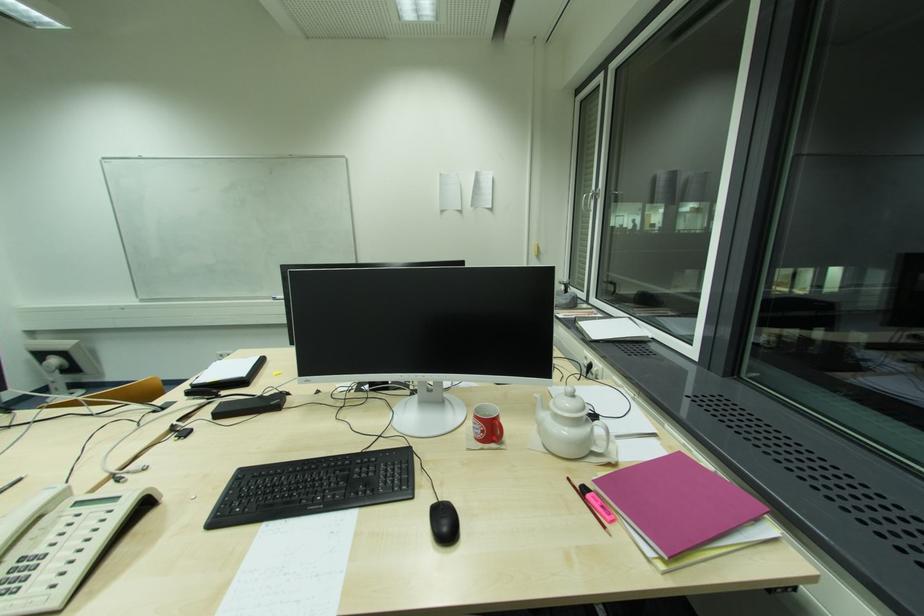
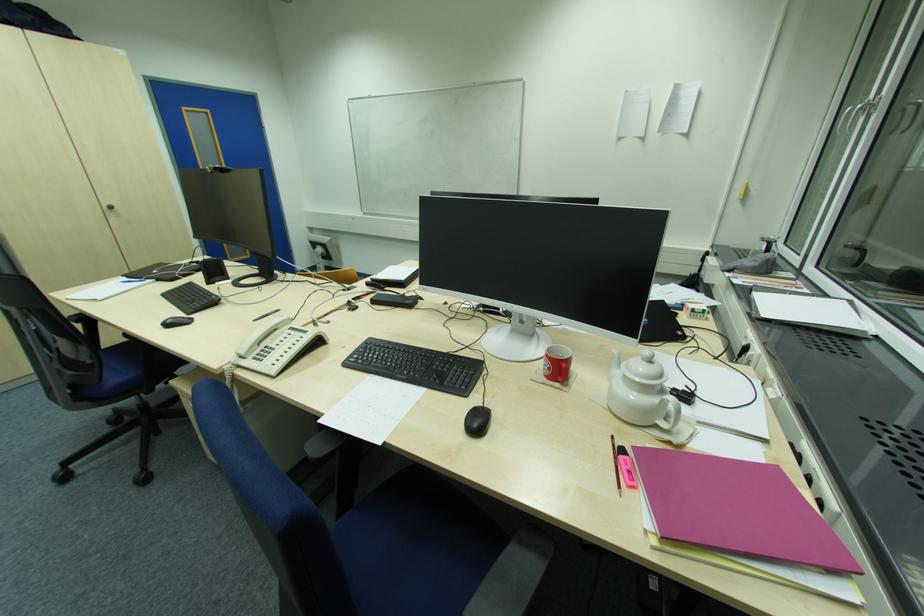
Locate, in the second image, the point that corresponds to [590,496] in the first image.

(623, 459)